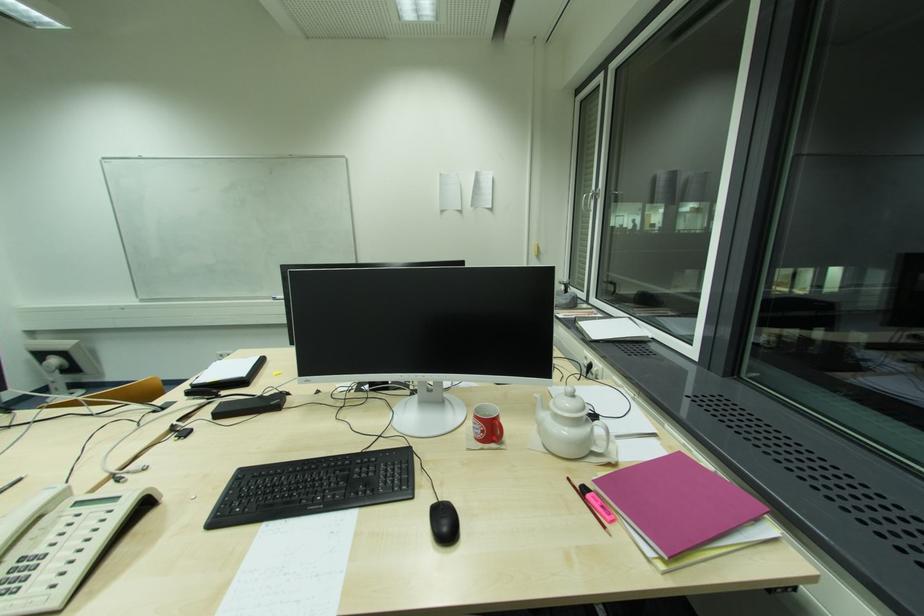
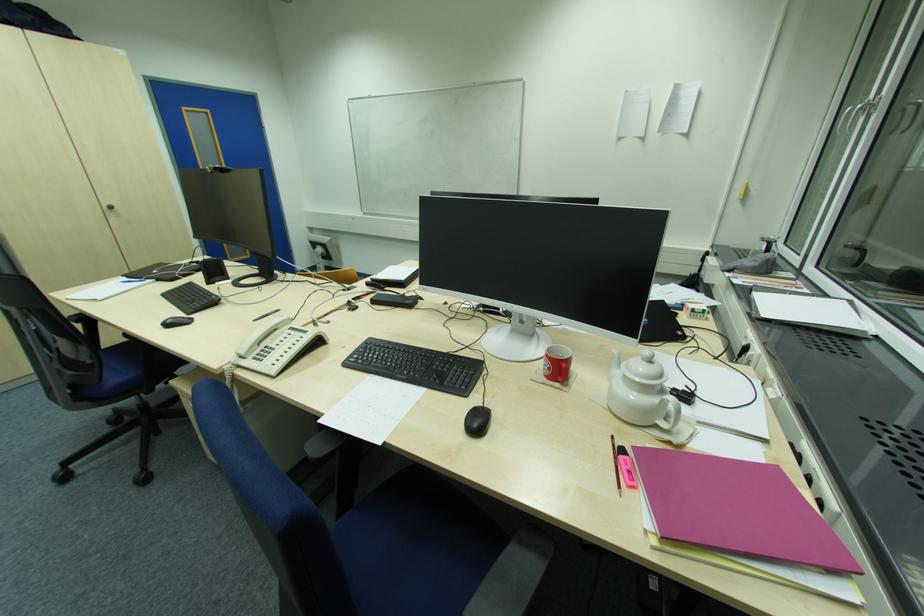
Locate, in the second image, the point that corresponds to [590,496] in the first image.

(623, 459)